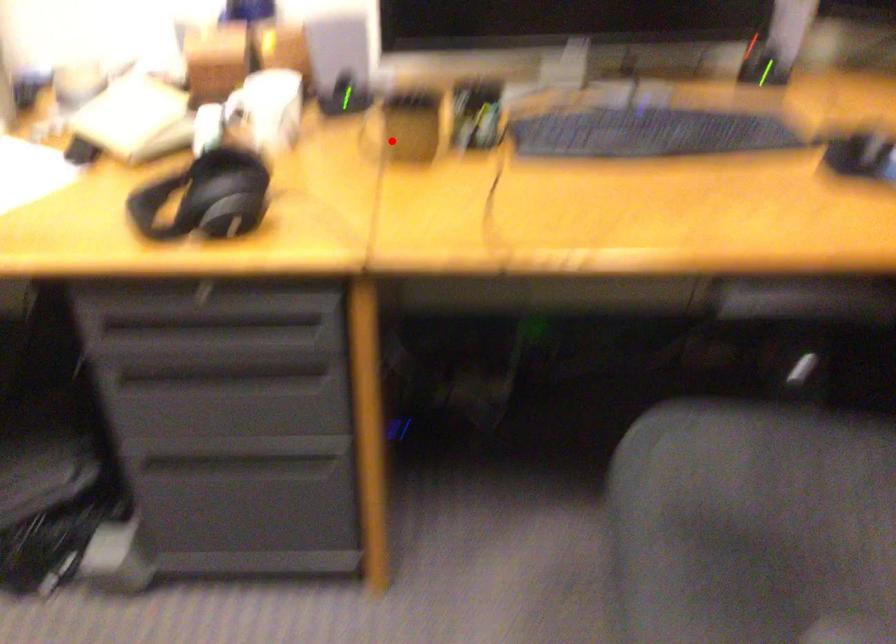
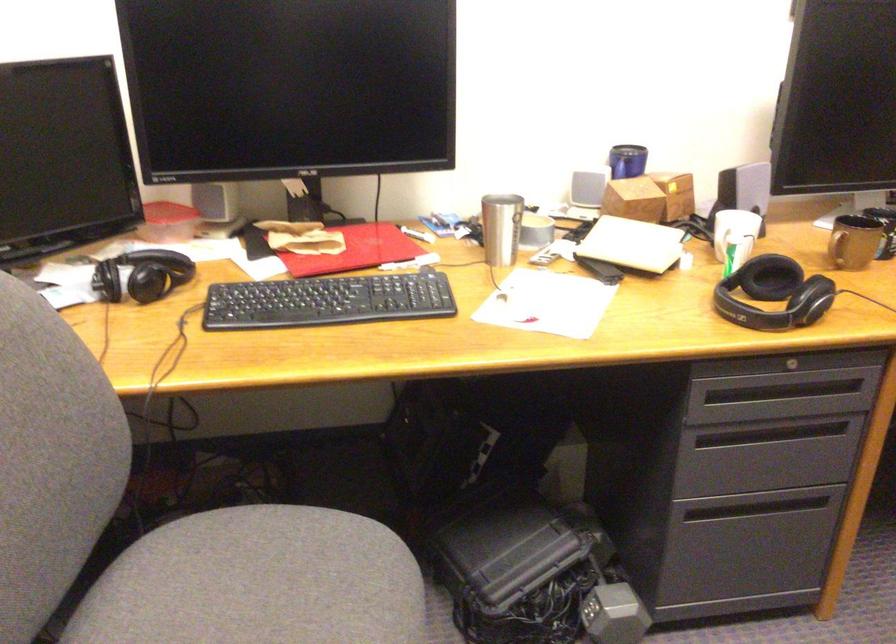
Question: I am providing you with two images of the same scene from different viewpoints. A red point is shown in image1. For the corresponding object point in image2, is it positioned nearer or farther from the camera?

Choices:
 (A) Nearer
 (B) Farther

Answer: (B)